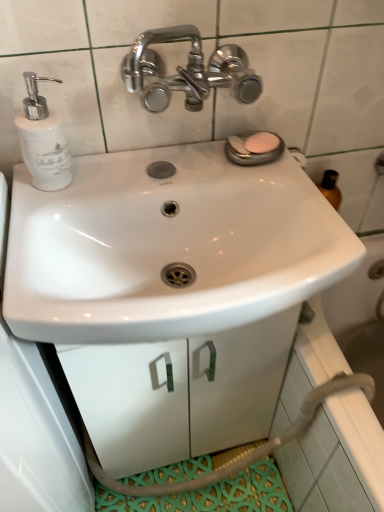
Question: From a real-world perspective, is white glossy sink at center physically located above or below white matte cabinet at center?

Choices:
 (A) above
 (B) below

Answer: (A)

Question: In terms of height, does white glossy sink at center look taller or shorter compared to white matte cabinet at center?

Choices:
 (A) short
 (B) tall

Answer: (A)

Question: Estimate the real-world distances between objects in this image. Which object is farther from the white glossy soap dispenser at left?

Choices:
 (A) white glossy sink at center
 (B) white matte cabinet at center
 (C) pink matte soap at upper right

Answer: (B)

Question: Which object is the farthest from the white glossy sink at center?

Choices:
 (A) white matte cabinet at center
 (B) white glossy soap dispenser at left
 (C) pink matte soap at upper right

Answer: (C)